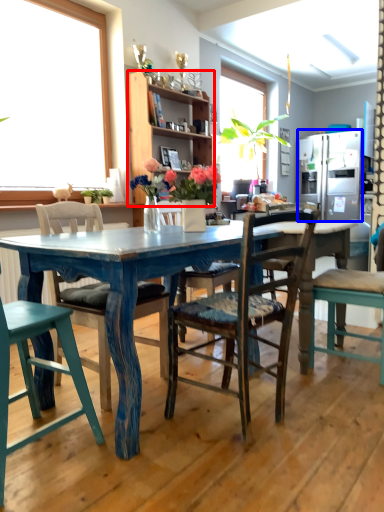
Question: Which of the following is the farthest to the observer, cabinetry (highlighted by a red box) or refrigerator (highlighted by a blue box)?

Choices:
 (A) cabinetry
 (B) refrigerator

Answer: (B)